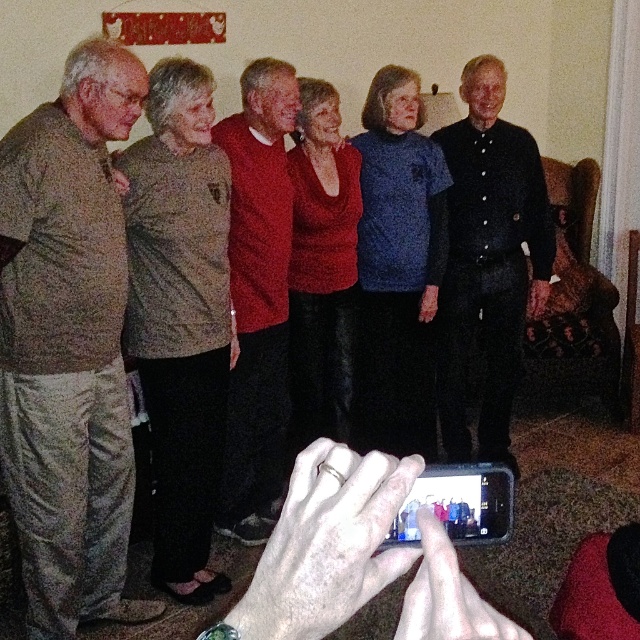
Question: In this image, where is camouflage pants at left located relative to black matte smartphone at lower center?

Choices:
 (A) left
 (B) right

Answer: (A)

Question: Considering the real-world distances, which object is closest to the black matte smartphone at lower center?

Choices:
 (A) camouflage pants at left
 (B) red textured sweater at center

Answer: (A)

Question: Considering the real-world distances, which object is farthest from the black button-up shirt at center?

Choices:
 (A) matte brown sweater at upper left
 (B) red textured sweater at center

Answer: (A)

Question: Does camouflage pants at left have a lesser width compared to matte brown sweater at upper left?

Choices:
 (A) yes
 (B) no

Answer: (B)

Question: Which object appears closest to the camera in this image?

Choices:
 (A) black matte smartphone at lower center
 (B) black button-up shirt at center
 (C) camouflage pants at left

Answer: (A)

Question: Can you confirm if camouflage pants at left is positioned to the left of red textured sweater at center?

Choices:
 (A) yes
 (B) no

Answer: (A)